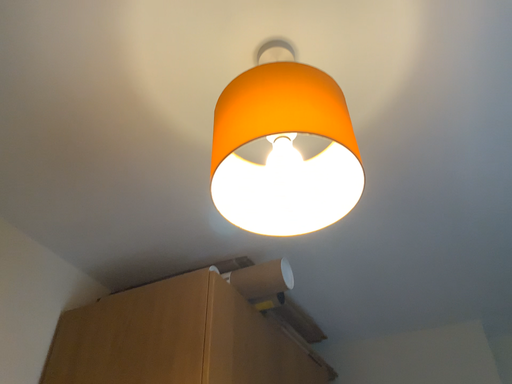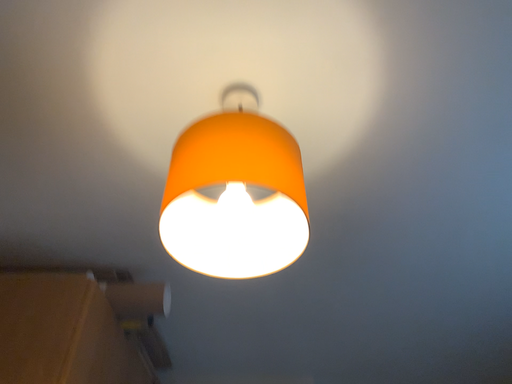
Question: How did the camera likely rotate when shooting the video?

Choices:
 (A) rotated right
 (B) rotated left

Answer: (A)